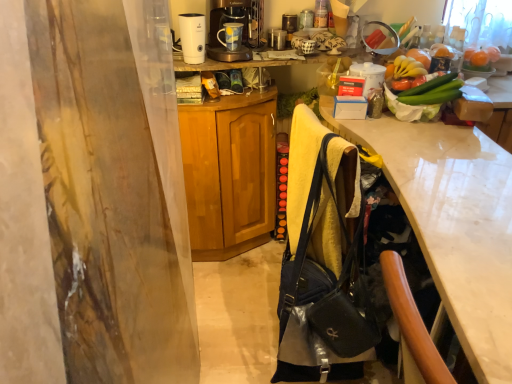
What is the approximate width of matte black handbag at center?

It is 22.39 centimeters.

This screenshot has height=384, width=512. Describe the element at coordinates (322, 303) in the screenshot. I see `matte black handbag at center` at that location.

Image resolution: width=512 pixels, height=384 pixels. Describe the element at coordinates (192, 37) in the screenshot. I see `white plastic humidifier at upper center` at that location.

What do you see at coordinates (480, 58) in the screenshot? The width and height of the screenshot is (512, 384). I see `orange matte fruit at upper right` at bounding box center [480, 58].

In order to face metallic silver coffee maker at upper center, which appears as the 2th appliance when viewed from the right, should I rotate leftwards or rightwards?

You should look right and rotate roughly 3.560 degrees.

Image resolution: width=512 pixels, height=384 pixels. Find the location of `metallic silver coffee maker at upper center, the second appliance viewed from the front`. metallic silver coffee maker at upper center, the second appliance viewed from the front is located at coordinates (278, 39).

What is the approximate height of white glossy desk at right?

The height of white glossy desk at right is 38.71 inches.

Describe the element at coordinates (454, 223) in the screenshot. The image size is (512, 384). I see `white glossy desk at right` at that location.

What is the approximate width of metallic silver coffee maker at upper center?

metallic silver coffee maker at upper center is 16.43 inches wide.

Find the location of `metallic silver coffee maker at upper center`. metallic silver coffee maker at upper center is located at coordinates (226, 33).

This screenshot has width=512, height=384. Find the location of `matte black handbag at center`. matte black handbag at center is located at coordinates point(322,303).

From a real-world perspective, is white glossy mug at upper center, the second appliance in the back-to-front sequence, on orange matte fruit at upper right?

No, from a real-world perspective, white glossy mug at upper center, the second appliance in the back-to-front sequence, is not on top of orange matte fruit at upper right.

Measure the distance from white glossy mug at upper center, the second appliance when ordered from left to right, to orange matte fruit at upper right.

white glossy mug at upper center, the second appliance when ordered from left to right, and orange matte fruit at upper right are 25.09 inches apart from each other.

Considering their positions, is white glossy mug at upper center, the second appliance when ordered from left to right, located in front of or behind orange matte fruit at upper right?

white glossy mug at upper center, the second appliance when ordered from left to right, is in front of orange matte fruit at upper right.

Is the surface of white glossy mug at upper center, the second appliance in the back-to-front sequence, in direct contact with orange matte fruit at upper right?

No, white glossy mug at upper center, the second appliance in the back-to-front sequence, is not next to orange matte fruit at upper right.

Between point (308, 231) and point (490, 60), which one is positioned behind?

The point (490, 60) is behind.

From a real-world perspective, which object stands above the other?

orange matte fruit at upper right, from a real-world perspective.

Is matte black handbag at center facing away from orange matte fruit at upper right?

matte black handbag at center is not turned away from orange matte fruit at upper right.

Can you confirm if matte black handbag at center is shorter than orange matte fruit at upper right?

Incorrect, the height of matte black handbag at center does not fall short of that of orange matte fruit at upper right.

Is metallic silver coffee maker at upper center, the second appliance viewed from the front, far from white glossy mug at upper center, the second appliance when ordered from left to right?

No, metallic silver coffee maker at upper center, the second appliance viewed from the front, is not far away from white glossy mug at upper center, the second appliance when ordered from left to right.

Visually, is metallic silver coffee maker at upper center, arranged as the second appliance when ordered from the bottom, positioned to the left or to the right of white glossy mug at upper center, the second appliance in the back-to-front sequence?

In the image, metallic silver coffee maker at upper center, arranged as the second appliance when ordered from the bottom, appears on the left side of white glossy mug at upper center, the second appliance in the back-to-front sequence.

Is metallic silver coffee maker at upper center, which appears as the 2th appliance when viewed from the right, looking in the opposite direction of white glossy mug at upper center, positioned as the first appliance in front-to-back order?

No.

Does white plastic humidifier at upper center turn towards blue glazed mug at upper center?

No, white plastic humidifier at upper center is not facing towards blue glazed mug at upper center.

Who is shorter, white plastic humidifier at upper center or blue glazed mug at upper center?

blue glazed mug at upper center.

How many degrees apart are the facing directions of white plastic humidifier at upper center and blue glazed mug at upper center?

5.06 degrees.

From the image's perspective, between white plastic humidifier at upper center and blue glazed mug at upper center, who is located below?

white plastic humidifier at upper center.

Does matte black handbag at center have a greater width compared to blue glazed mug at upper center?

Yes, matte black handbag at center is wider than blue glazed mug at upper center.

Which of these two, matte black handbag at center or blue glazed mug at upper center, is smaller?

Smaller between the two is blue glazed mug at upper center.

Would you say metallic silver coffee maker at upper center is outside white glossy desk at right?

metallic silver coffee maker at upper center is positioned outside white glossy desk at right.

Which object is thinner, metallic silver coffee maker at upper center or white glossy desk at right?

Thinner between the two is metallic silver coffee maker at upper center.

From the picture: How different are the orientations of metallic silver coffee maker at upper center and white glossy desk at right in degrees?

The angular difference between metallic silver coffee maker at upper center and white glossy desk at right is 77.5 degrees.

The image size is (512, 384). I want to click on kitchen appliance above the orange matte fruit at upper right (from the image's perspective), so click(x=192, y=37).

Can you tell me how much white plastic humidifier at upper center and orange matte fruit at upper right differ in facing direction?

1.69 degrees.

Considering the relative positions of white plastic humidifier at upper center and orange matte fruit at upper right in the image provided, is white plastic humidifier at upper center to the right of orange matte fruit at upper right from the viewer's perspective?

In fact, white plastic humidifier at upper center is to the left of orange matte fruit at upper right.

From the picture: Which is further, (196, 19) or (490, 64)?

The point (490, 64) is more distant.

The width and height of the screenshot is (512, 384). In order to click on fruit behind the white glossy mug at upper center, which appears as the 2th appliance when viewed from the top in this screenshot , I will do `click(480, 58)`.

In the image, there is a matte black handbag at center. At what (x,y) coordinates should I click in order to perform the action: click on fruit above it (from the image's perspective). Please return your answer as a coordinate pair (x, y). This screenshot has height=384, width=512. Looking at the image, I should click on (480, 58).

Which object lies further to the anchor point metallic silver coffee maker at upper center, orange matte fruit at upper right or blue glazed mug at upper center?

orange matte fruit at upper right is further to metallic silver coffee maker at upper center.

Based on their spatial positions, is blue glazed mug at upper center or metallic silver coffee maker at upper center, arranged as the second appliance when ordered from the bottom, closer to wooden cabinet at center?

blue glazed mug at upper center.

When comparing their distances from white glossy mug at upper center, the second appliance in the back-to-front sequence, does orange matte fruit at upper right or blue glazed mug at upper center seem closer?

blue glazed mug at upper center lies closer to white glossy mug at upper center, the second appliance in the back-to-front sequence, than the other object.

Considering their positions, is metallic silver coffee maker at upper center, arranged as the second appliance when ordered from the bottom, positioned closer to orange matte fruit at upper right than wooden cabinet at center?

metallic silver coffee maker at upper center, arranged as the second appliance when ordered from the bottom, lies closer to orange matte fruit at upper right than the other object.

From the image, which object appears to be farther from metallic silver coffee maker at upper center, matte black handbag at center or white glossy mug at upper center, positioned as the first appliance in front-to-back order?

matte black handbag at center lies further to metallic silver coffee maker at upper center than the other object.

From the image, which object appears to be farther from matte black handbag at center, white glossy mug at upper center, which ranks as the 1th appliance in bottom-to-top order, or orange matte fruit at upper right?

orange matte fruit at upper right.

When comparing their distances from orange matte fruit at upper right, does blue glazed mug at upper center or white glossy mug at upper center, which appears as the 2th appliance when viewed from the top, seem further?

blue glazed mug at upper center is further to orange matte fruit at upper right.

Which object lies further to the anchor point metallic silver coffee maker at upper center, which appears as the 2th appliance when viewed from the right, matte black handbag at center or wooden cabinet at center?

matte black handbag at center is positioned further to the anchor metallic silver coffee maker at upper center, which appears as the 2th appliance when viewed from the right.

At what (x,y) coordinates should I click in order to perform the action: click on coffee cup between wooden cabinet at center and orange matte fruit at upper right. Please return your answer as a coordinate pair (x, y). Image resolution: width=512 pixels, height=384 pixels. Looking at the image, I should click on (231, 36).

This screenshot has height=384, width=512. I want to click on kitchen appliance between metallic silver coffee maker at upper center, arranged as the second appliance when ordered from the bottom, and white glossy desk at right vertically, so click(x=192, y=37).

You are a GUI agent. You are given a task and a screenshot of the screen. Output one action in this format:
    pyautogui.click(x=<x>, y=<y>)
    Task: Click on the cabinetry that lies between white plastic humidifier at upper center and matte black handbag at center from top to bottom
    Image resolution: width=512 pixels, height=384 pixels.
    Given the screenshot: What is the action you would take?
    pyautogui.click(x=229, y=173)

Identify the location of coffee cup that lies between metallic silver coffee maker at upper center and white glossy desk at right from top to bottom. This screenshot has height=384, width=512. (231, 36).